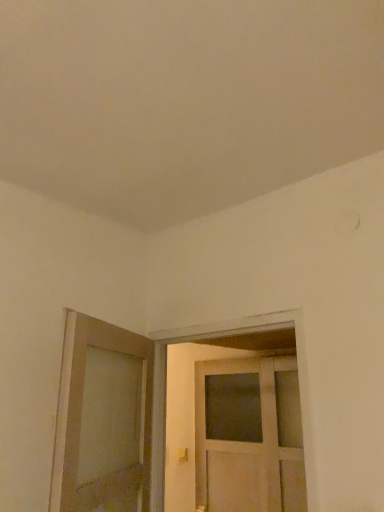
Question: Based on their sizes in the image, would you say matte wooden door at left, which is the second door from right to left, is bigger or smaller than white wooden door at center, placed as the second door when sorted from left to right?

Choices:
 (A) small
 (B) big

Answer: (B)

Question: In the image, is matte wooden door at left, which is the 1th door in left-to-right order, positioned in front of or behind white wooden door at center, placed as the second door when sorted from left to right?

Choices:
 (A) behind
 (B) front

Answer: (B)

Question: Which is farther from the white wooden door at center, placed as the second door when sorted from left to right?

Choices:
 (A) matte wooden door at left, which is the second door from right to left
 (B) matte gold door handle at lower center

Answer: (B)

Question: Which object is positioned closest to the matte gold door handle at lower center?

Choices:
 (A) white wooden door at center, the first door in the right-to-left sequence
 (B) matte wooden door at left, which is the second door from right to left

Answer: (A)